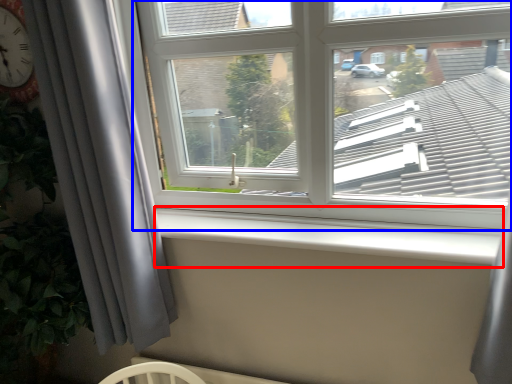
Question: Which of the following is the closest to the observer, window sill (highlighted by a red box) or window (highlighted by a blue box)?

Choices:
 (A) window sill
 (B) window

Answer: (B)